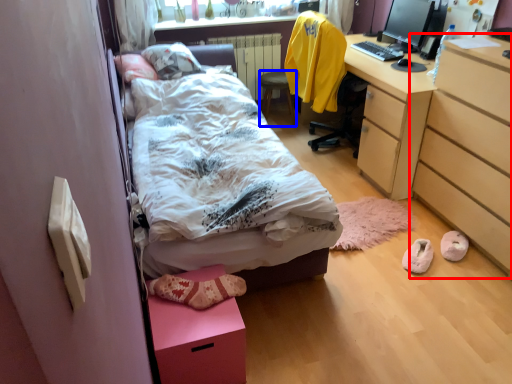
Question: Among these objects, which one is farthest to the camera, chest of drawers (highlighted by a red box) or stool (highlighted by a blue box)?

Choices:
 (A) chest of drawers
 (B) stool

Answer: (B)